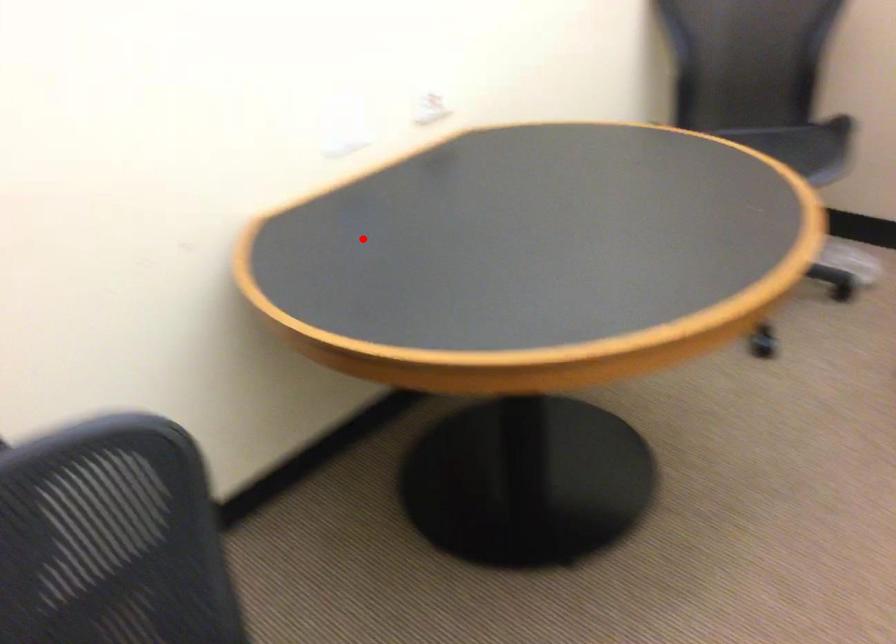
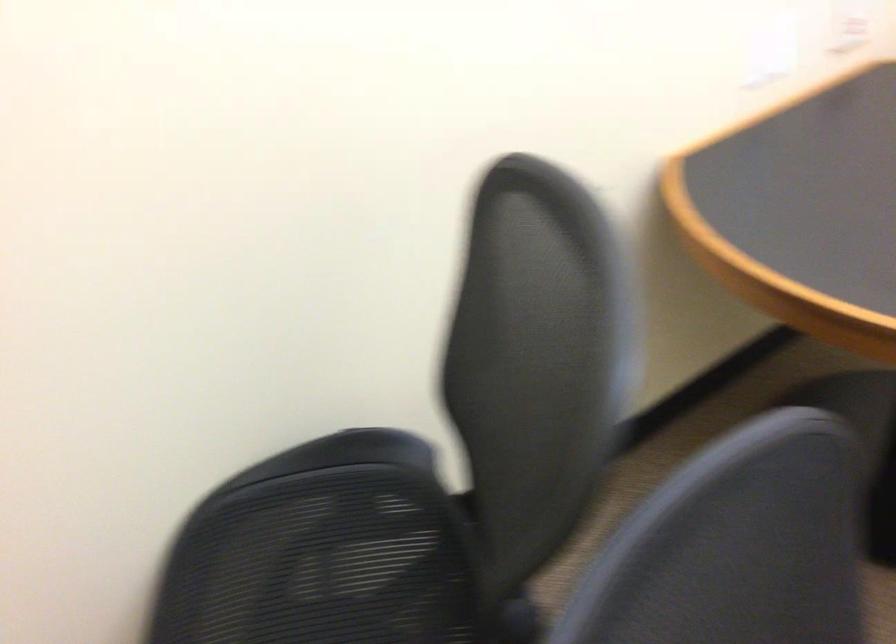
Question: A red point is marked in image1. In image2, is the corresponding 3D point closer to the camera or farther? Reply with the corresponding letter.

Choices:
 (A) The corresponding 3D point is closer.
 (B) The corresponding 3D point is farther.

Answer: (A)